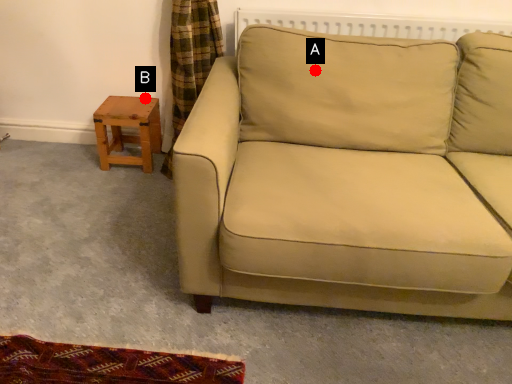
Question: Two points are circled on the image, labeled by A and B beside each circle. Which point appears closest to the camera in this image?

Choices:
 (A) A is closer
 (B) B is closer

Answer: (A)